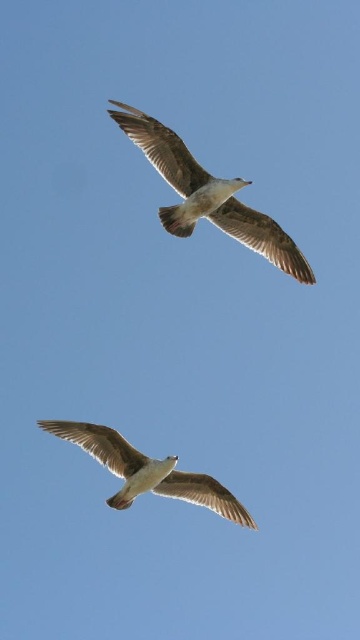
You are observing two points in the sky where seagulls are flying. The points are labeled as point (176,225) and point (111,461). Which point is nearer to you?

Point (176,225) is closer to the viewer than point (111,461).

You are an ornithologist studying the flight patterns of birds. You observe a white feathered bird at upper center in the image. Can you determine its exact coordinates in the scene?

The white feathered bird at upper center is located at point coordinates of [208,195].